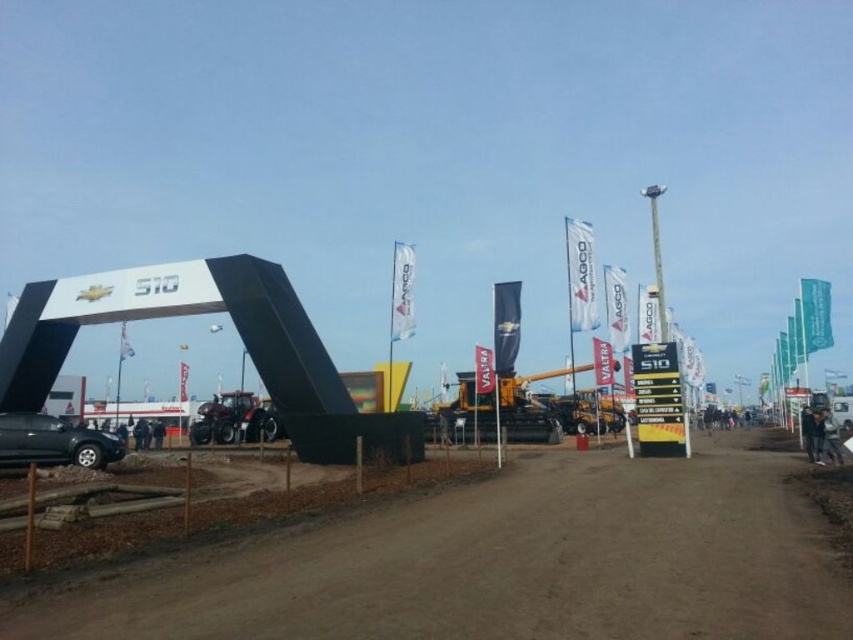
You are driving a matte black suv at lower left and want to turn onto the brown dirt track at center. Is there enough space for the SUV to make the turn without hitting anything?

The brown dirt track at center might be wider than matte black suv at lower left, so there is a possibility that the SUV can make the turn safely. However, the exact width difference is uncertain based on the provided information.

You are a photographer at the event and want to capture both the brown dirt track at center and the metallic red tractor at center in a single shot. Based on their positions, which object should you focus on first to ensure both are in frame?

The brown dirt track at center is in front of the metallic red tractor at center, so you should focus on the brown dirt track at center first to ensure both are in frame.